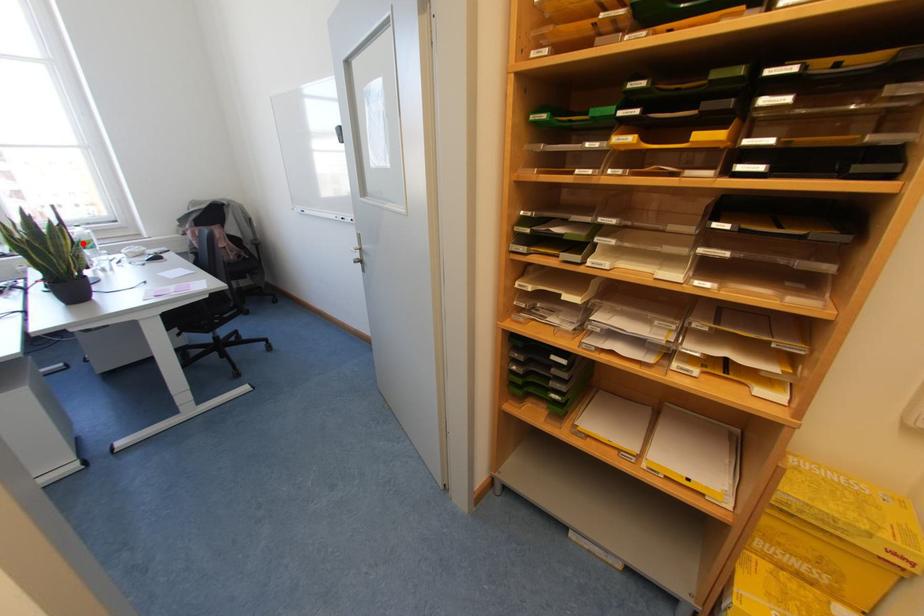
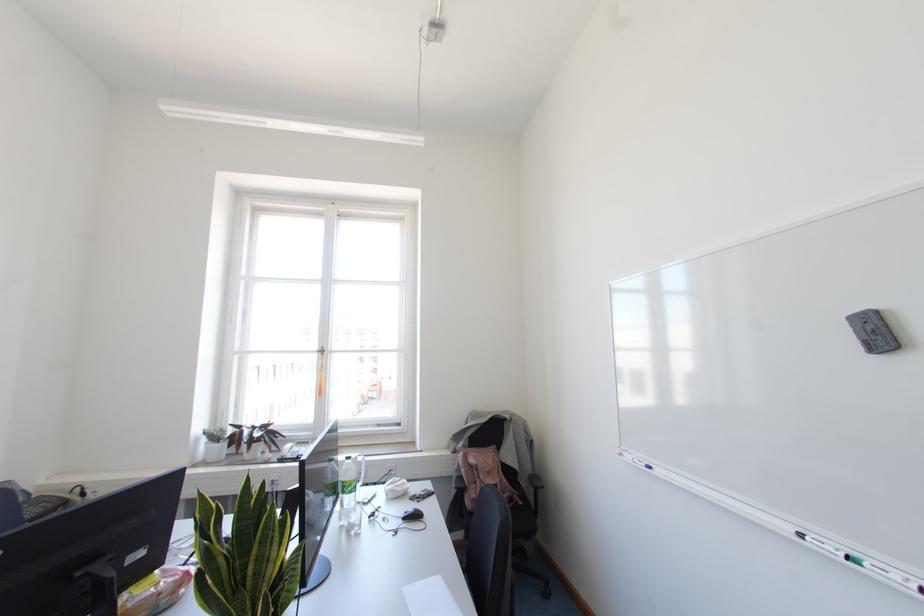
Where in the second image is the point corresponding to the highlighted location from the first image?

(343, 485)